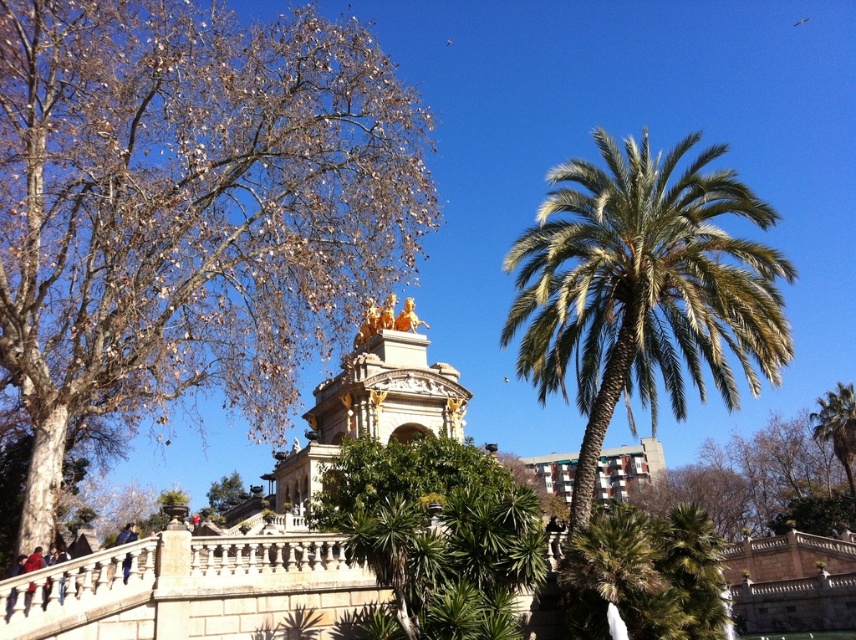
Question: Which point is closer to the camera taking this photo?

Choices:
 (A) (851, 497)
 (B) (740, 337)
 (C) (55, 452)

Answer: (C)

Question: Considering the relative positions of brown bark tree at upper left and green leafy palm at center in the image provided, where is brown bark tree at upper left located with respect to green leafy palm at center?

Choices:
 (A) left
 (B) right

Answer: (A)

Question: Does brown bark tree at upper left have a lesser width compared to green leafy palm tree at right?

Choices:
 (A) no
 (B) yes

Answer: (A)

Question: Which point is closer to the camera?

Choices:
 (A) (168, 116)
 (B) (845, 419)
 (C) (593, 336)

Answer: (C)

Question: Which point appears farthest from the camera in this image?

Choices:
 (A) (852, 412)
 (B) (519, 310)
 (C) (40, 132)

Answer: (A)

Question: Does brown bark tree at upper left come behind green leafy palm at center?

Choices:
 (A) no
 (B) yes

Answer: (A)